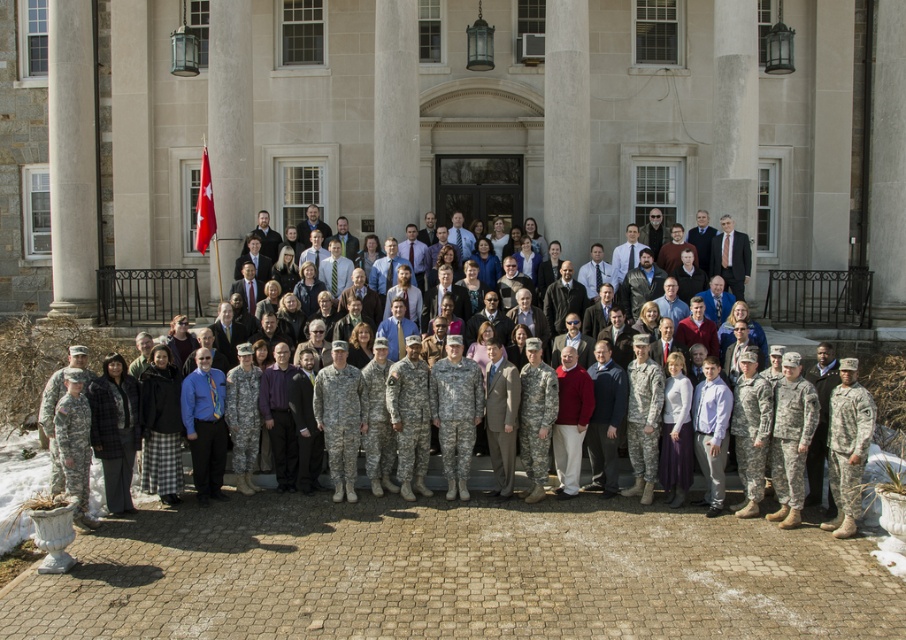
Is point (847, 531) positioned in front of point (152, 484)?

Yes, it is.

Who is more forward, [801,502] or [171,472]?

Point [801,502]

Describe the element at coordinates (779, 432) in the screenshot. I see `camouflage uniform at center` at that location.

Where is `camouflage uniform at center`? The width and height of the screenshot is (906, 640). camouflage uniform at center is located at coordinates (779, 432).